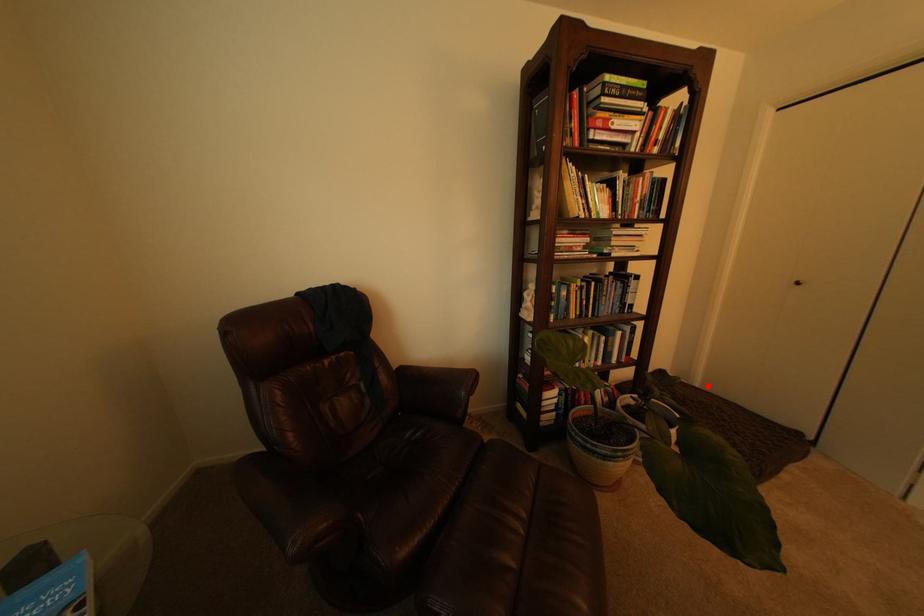
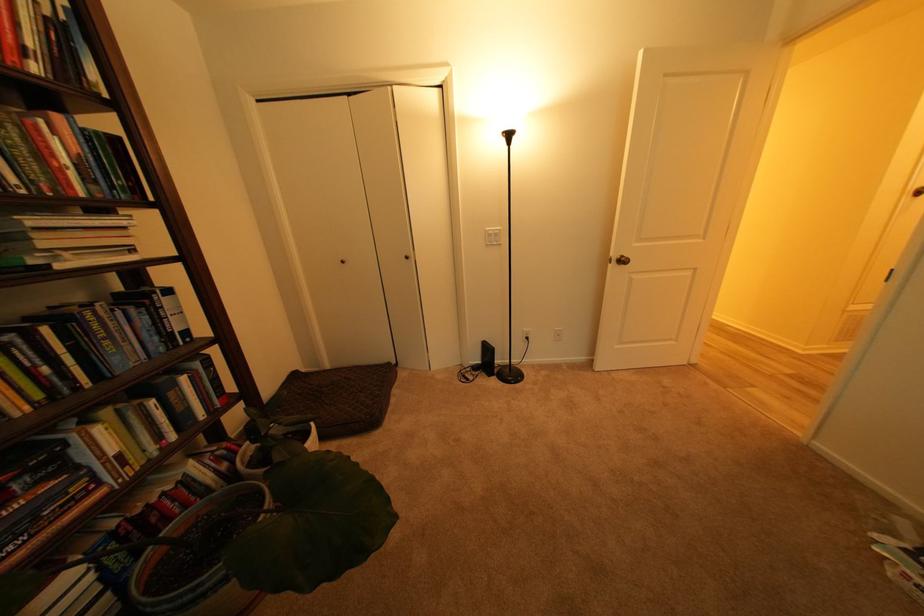
Question: I am providing you with two images of the same scene from different viewpoints. In image1, a red point is highlighted. Considering the same 3D point in image2, which of the following is correct?

Choices:
 (A) It is closer
 (B) It is farther

Answer: (A)